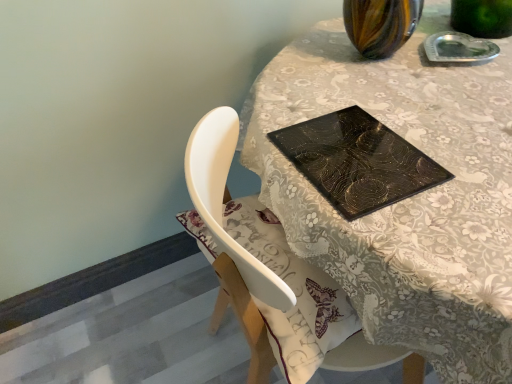
Image resolution: width=512 pixels, height=384 pixels. Identify the location of free space above black glossy placemat at upper center (from a real-world perspective). (x=347, y=147).